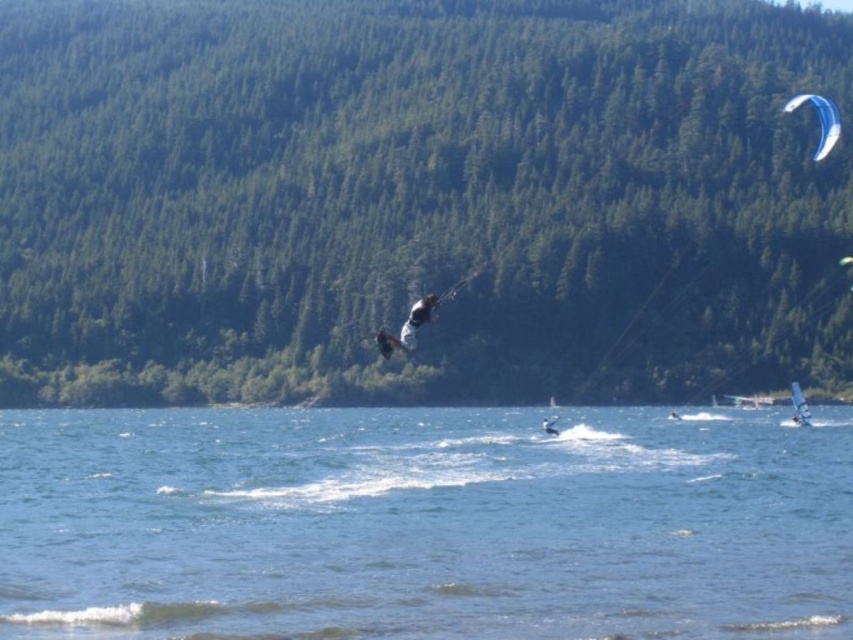
Which of these two, white fabric kite at center or blue glossy parachute at upper right, stands taller?

Standing taller between the two is blue glossy parachute at upper right.

Does white fabric kite at center have a larger size compared to blue glossy parachute at upper right?

No.

Between point (398, 342) and point (827, 150), which one is positioned behind?

The point (827, 150) is more distant.

Find the location of a particular element. Image resolution: width=853 pixels, height=640 pixels. white fabric kite at center is located at coordinates 407,326.

Based on the photo, does clear blue water at center appear on the right side of white fabric kite at center?

Correct, you'll find clear blue water at center to the right of white fabric kite at center.

Which is below, clear blue water at center or white fabric kite at center?

clear blue water at center

Between point (471, 420) and point (428, 310), which one is positioned in front?

Point (428, 310) is more forward.

Identify the location of clear blue water at center. The image size is (853, 640). (422, 524).

Does blue glossy parachute at upper right lie behind white matte surfboard at center?

No, it is not.

Who is more forward, [836,136] or [544,429]?

Point [544,429] is more forward.

Find the location of a particular element. This screenshot has height=640, width=853. blue glossy parachute at upper right is located at coordinates (819, 120).